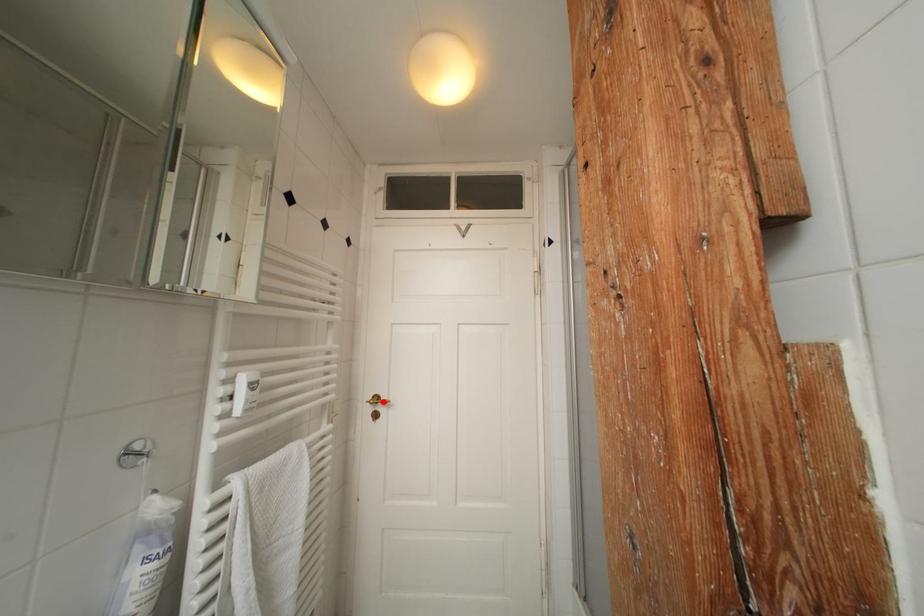
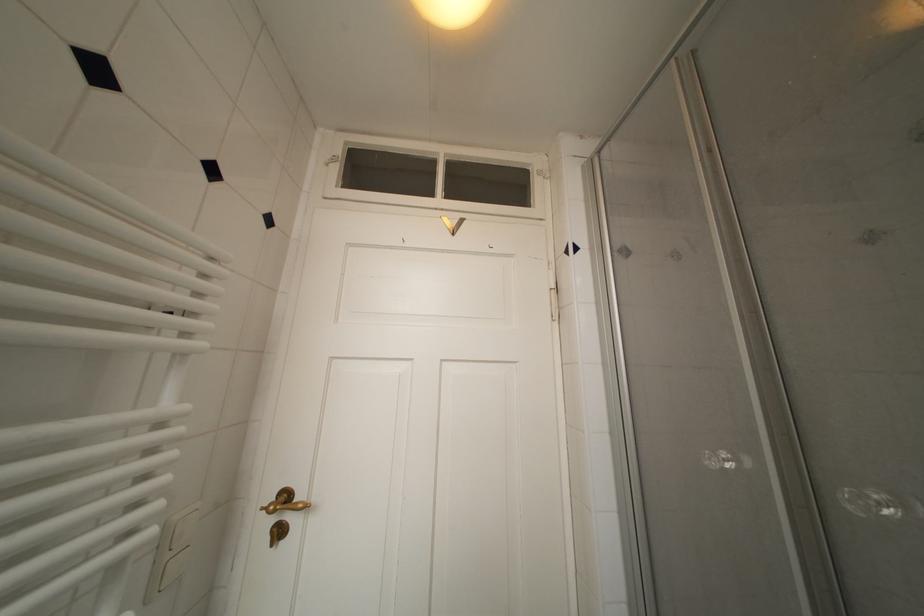
In the second image, find the point that corresponds to the highlighted location in the first image.

(293, 500)